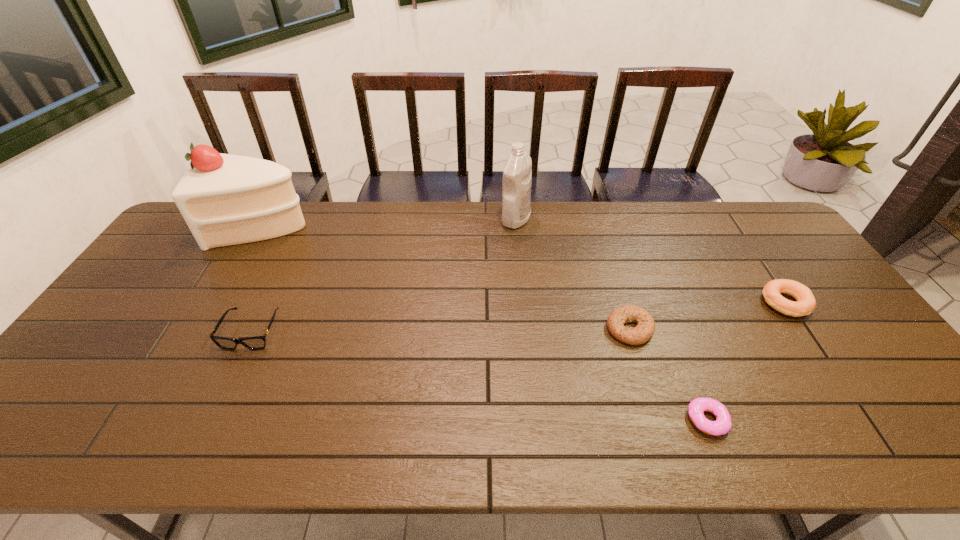
I want to click on vacant space located 0.050m on the front-facing side of the sunglasses, so click(234, 368).

The height and width of the screenshot is (540, 960). Identify the location of free space located on the left of the right bagel. (646, 303).

I want to click on vacant area situated 0.230m on the left of the fifth tallest object, so click(521, 329).

Identify the location of blank area located 0.330m on the right of the doughnut. This screenshot has width=960, height=540. click(872, 420).

Find the location of a particular element. cake that is at the far edge is located at coordinates (225, 199).

Where is `detergent located in the far edge section of the desktop`? Image resolution: width=960 pixels, height=540 pixels. detergent located in the far edge section of the desktop is located at coordinates [517, 173].

Locate an element on the screen. object that is at the near edge is located at coordinates (696, 408).

At what (x,y) coordinates should I click in order to perform the action: click on object present at the left edge. Please return your answer as a coordinate pair (x, y). Image resolution: width=960 pixels, height=540 pixels. Looking at the image, I should click on (225, 199).

Where is `object present at the right edge`? This screenshot has width=960, height=540. object present at the right edge is located at coordinates (806, 303).

In order to click on object located at the far left corner in this screenshot , I will do `click(225, 199)`.